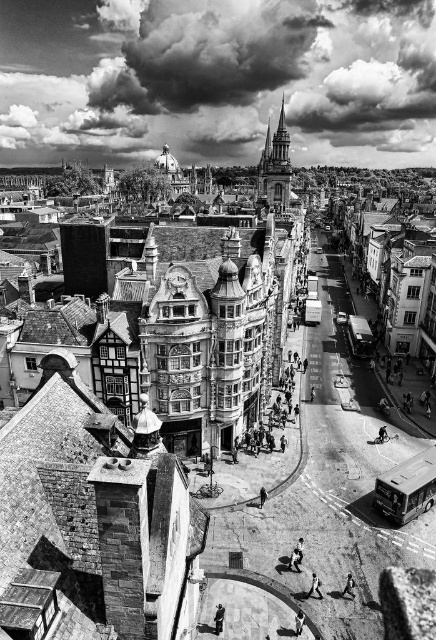
You are standing on a busy street and see a person wearing light gray fabric pants at lower center and a smooth skin person at center. How far apart are these two individuals?

The light gray fabric pants at lower center and smooth skin person at center are 8.14 feet apart from each other.